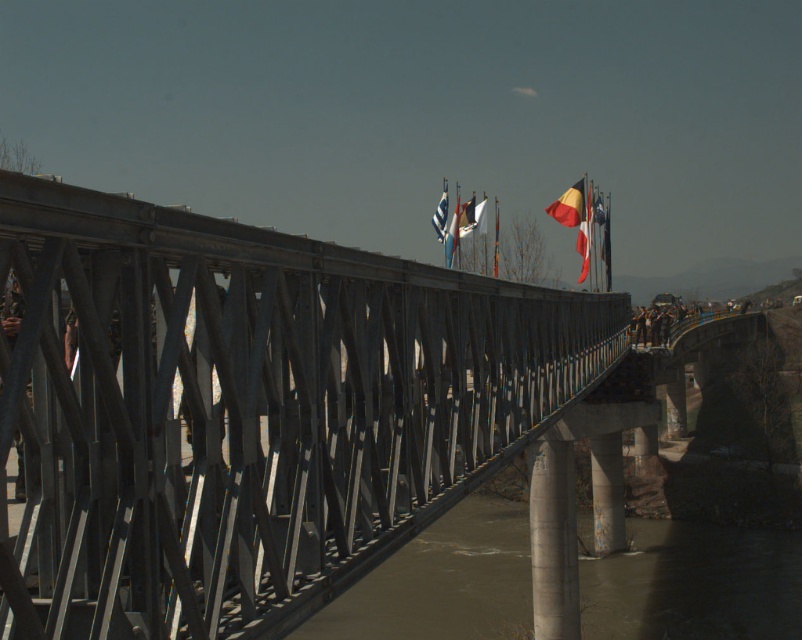
Is metallic bridge at center shorter than red and yellow striped flag at center?

Correct, metallic bridge at center is not as tall as red and yellow striped flag at center.

Who is taller, metallic bridge at center or red and yellow striped flag at center?

Standing taller between the two is red and yellow striped flag at center.

Is point (367, 360) more distant than point (573, 193)?

No, it is in front of (573, 193).

Locate an element on the screen. metallic bridge at center is located at coordinates [246, 410].

Consider the image. Can you confirm if red fabric flag at upper right is bigger than white fabric flag at center?

→ Correct, red fabric flag at upper right is larger in size than white fabric flag at center.

Does red fabric flag at upper right have a smaller size compared to white fabric flag at center?

No, red fabric flag at upper right is not smaller than white fabric flag at center.

Who is more forward, (x=590, y=218) or (x=440, y=228)?

Point (x=440, y=228) is more forward.

Where is `red fabric flag at upper right`? This screenshot has height=640, width=802. red fabric flag at upper right is located at coordinates (585, 236).

Who is shorter, metallic bridge at center or brown muddy water at center?

With less height is metallic bridge at center.

Locate an element on the screen. The image size is (802, 640). metallic bridge at center is located at coordinates (246, 410).

Find the location of `metallic bridge at center`. metallic bridge at center is located at coordinates click(246, 410).